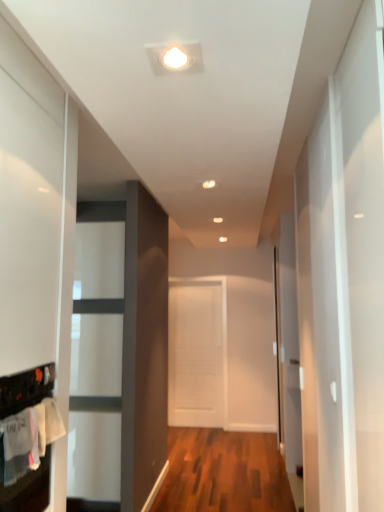
Question: Can you confirm if transparent glass door at right is thinner than white matte door at center?

Choices:
 (A) no
 (B) yes

Answer: (A)

Question: Is transparent glass door at right not within white matte door at center?

Choices:
 (A) no
 (B) yes

Answer: (B)

Question: Does transparent glass door at right have a lesser height compared to white matte door at center?

Choices:
 (A) no
 (B) yes

Answer: (A)

Question: Does transparent glass door at right come in front of white matte door at center?

Choices:
 (A) no
 (B) yes

Answer: (B)

Question: Is transparent glass door at right beside white matte door at center?

Choices:
 (A) yes
 (B) no

Answer: (B)

Question: Considering the positions of transparent glass door at right and white cotton laundry at lower left in the image, is transparent glass door at right wider or thinner than white cotton laundry at lower left?

Choices:
 (A) thin
 (B) wide

Answer: (B)

Question: Considering the positions of transparent glass door at right and white cotton laundry at lower left in the image, is transparent glass door at right bigger or smaller than white cotton laundry at lower left?

Choices:
 (A) small
 (B) big

Answer: (B)

Question: Considering the relative positions of transparent glass door at right and white cotton laundry at lower left in the image provided, is transparent glass door at right to the left or to the right of white cotton laundry at lower left?

Choices:
 (A) left
 (B) right

Answer: (B)

Question: From the image's perspective, is transparent glass door at right located above or below white cotton laundry at lower left?

Choices:
 (A) below
 (B) above

Answer: (A)

Question: Considering the positions of white matte door at center and transparent glass door at right in the image, is white matte door at center bigger or smaller than transparent glass door at right?

Choices:
 (A) small
 (B) big

Answer: (A)

Question: Relative to transparent glass door at right, is white matte door at center in front or behind?

Choices:
 (A) behind
 (B) front

Answer: (A)

Question: From a real-world perspective, is white matte door at center positioned above or below transparent glass door at right?

Choices:
 (A) below
 (B) above

Answer: (A)

Question: Is white matte door at center wider or thinner than transparent glass door at right?

Choices:
 (A) wide
 (B) thin

Answer: (B)

Question: Is white cotton laundry at lower left in front of or behind white matte door at center in the image?

Choices:
 (A) front
 (B) behind

Answer: (A)

Question: From the image's perspective, is white cotton laundry at lower left located above or below white matte door at center?

Choices:
 (A) below
 (B) above

Answer: (B)